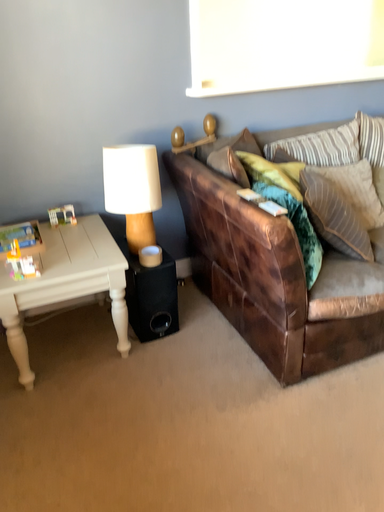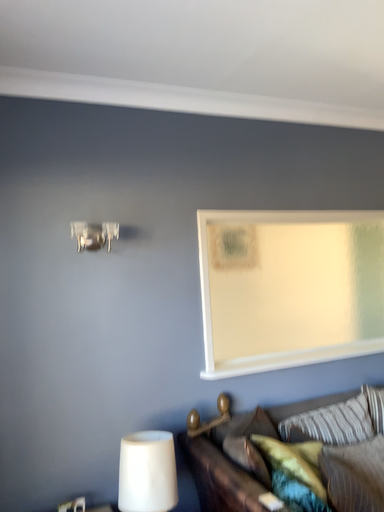
Question: How did the camera likely rotate when shooting the video?

Choices:
 (A) rotated downward
 (B) rotated upward

Answer: (B)